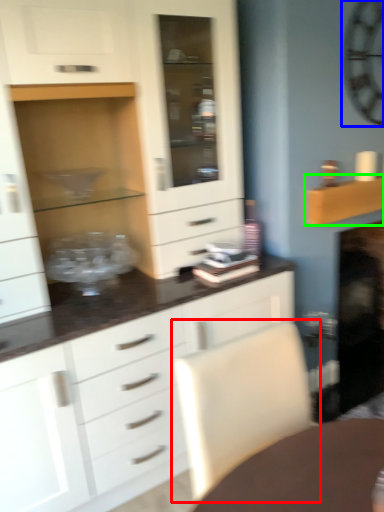
Question: Based on their relative distances, which object is nearer to swivel chair (highlighted by a red box)? Choose from clock (highlighted by a blue box) and shelf (highlighted by a green box).

Choices:
 (A) clock
 (B) shelf

Answer: (B)